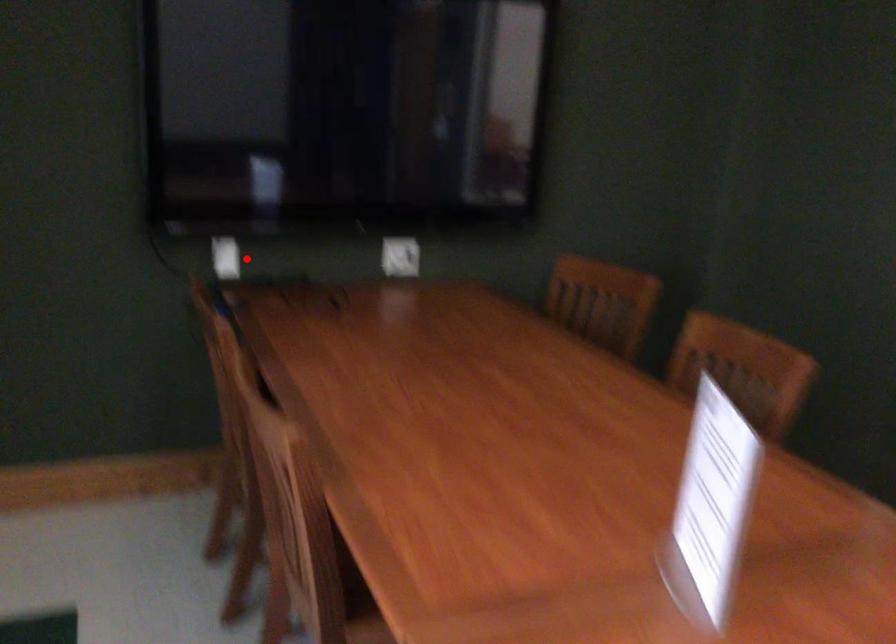
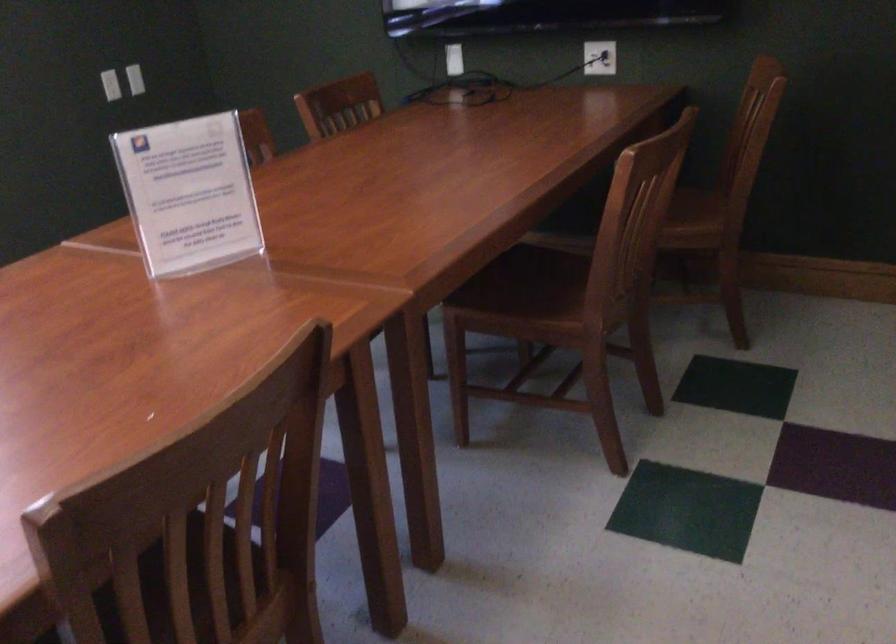
Question: I am providing you with two images of the same scene from different viewpoints. A red point is shown in image1. For the corresponding object point in image2, is it positioned nearer or farther from the camera?

Choices:
 (A) Nearer
 (B) Farther

Answer: (B)